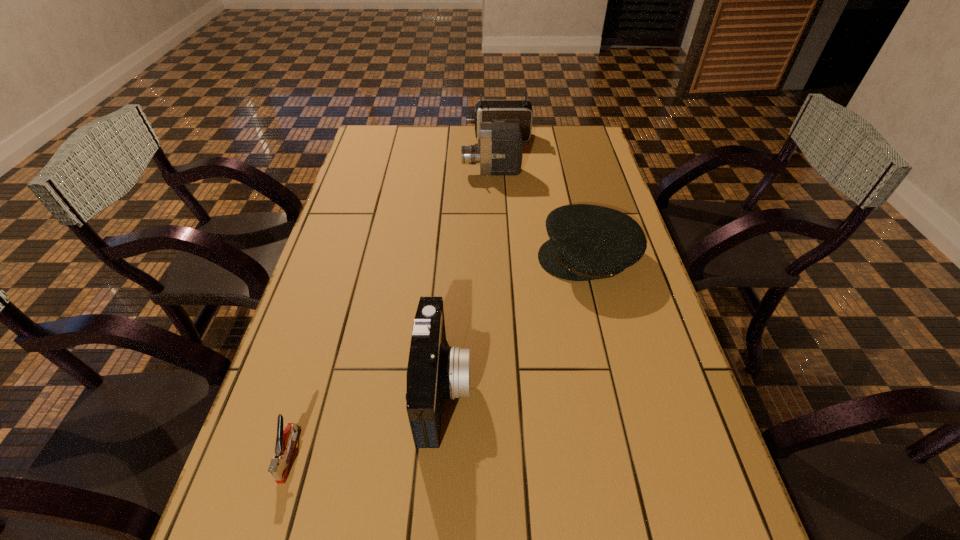
Locate an element on the screen. This screenshot has height=540, width=960. empty location between the nearest camcorder and the second nearest camcorder is located at coordinates (468, 280).

What are the coordinates of `object that stands as the fourth closest to the second farthest object` in the screenshot? It's located at (285, 441).

Choose which object is the second nearest neighbor to the nearest camcorder. Please provide its 2D coordinates. Your answer should be formatted as a tuple, i.e. [(x, y)], where the tuple contains the x and y coordinates of a point satisfying the conditions above.

[(587, 242)]

Where is `camcorder that is the closest one to the nearest camcorder`? Image resolution: width=960 pixels, height=540 pixels. camcorder that is the closest one to the nearest camcorder is located at coordinates (500, 150).

Locate an element on the screen. This screenshot has width=960, height=540. camcorder that is the closest to the second farthest camcorder is located at coordinates (513, 111).

Find the location of `blank space that satisfies the following two spatial constraints: 1. at the front of the second farthest object, highlighting the lens; 2. on the handle side of the stapler`. blank space that satisfies the following two spatial constraints: 1. at the front of the second farthest object, highlighting the lens; 2. on the handle side of the stapler is located at coordinates (501, 454).

What are the coordinates of `vacant area in the image that satisfies the following two spatial constraints: 1. on the front-facing side of the third nearest object; 2. on the handle side of the stapler` in the screenshot? It's located at (636, 454).

Identify the location of vacant point that satisfies the following two spatial constraints: 1. at the front of the second farthest camcorder, highlighting the lens; 2. on the handle side of the leftmost object. The width and height of the screenshot is (960, 540). (501, 454).